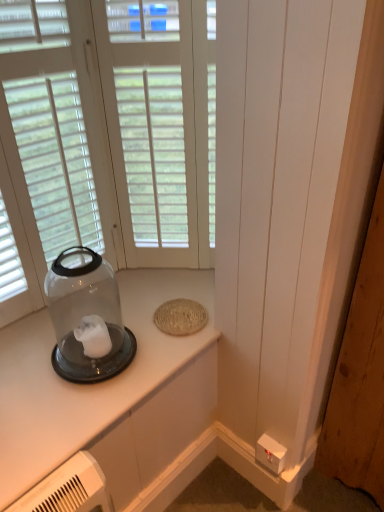
Question: Is transparent glass jar at left outside white plastic electric outlet at lower right?

Choices:
 (A) no
 (B) yes

Answer: (B)

Question: Does transparent glass jar at left appear on the right side of white plastic electric outlet at lower right?

Choices:
 (A) yes
 (B) no

Answer: (B)

Question: Is white plastic electric outlet at lower right at the back of transparent glass jar at left?

Choices:
 (A) no
 (B) yes

Answer: (A)

Question: Does transparent glass jar at left have a greater height compared to white plastic electric outlet at lower right?

Choices:
 (A) yes
 (B) no

Answer: (A)

Question: Can you see transparent glass jar at left touching white plastic electric outlet at lower right?

Choices:
 (A) no
 (B) yes

Answer: (A)

Question: Does transparent glass jar at left come behind white plastic electric outlet at lower right?

Choices:
 (A) yes
 (B) no

Answer: (B)

Question: Are clear glass jar at left and white plastic electric outlet at lower right beside each other?

Choices:
 (A) yes
 (B) no

Answer: (B)

Question: Would you consider clear glass jar at left to be distant from white plastic electric outlet at lower right?

Choices:
 (A) yes
 (B) no

Answer: (B)

Question: Does clear glass jar at left have a greater width compared to white plastic electric outlet at lower right?

Choices:
 (A) yes
 (B) no

Answer: (A)

Question: Considering the relative positions of clear glass jar at left and white plastic electric outlet at lower right in the image provided, is clear glass jar at left in front of white plastic electric outlet at lower right?

Choices:
 (A) yes
 (B) no

Answer: (A)

Question: Can you confirm if clear glass jar at left is taller than white plastic electric outlet at lower right?

Choices:
 (A) no
 (B) yes

Answer: (A)

Question: From the image's perspective, does clear glass jar at left appear lower than white plastic electric outlet at lower right?

Choices:
 (A) no
 (B) yes

Answer: (A)

Question: Is white wood window at center inside white plastic electric outlet at lower right?

Choices:
 (A) no
 (B) yes

Answer: (A)